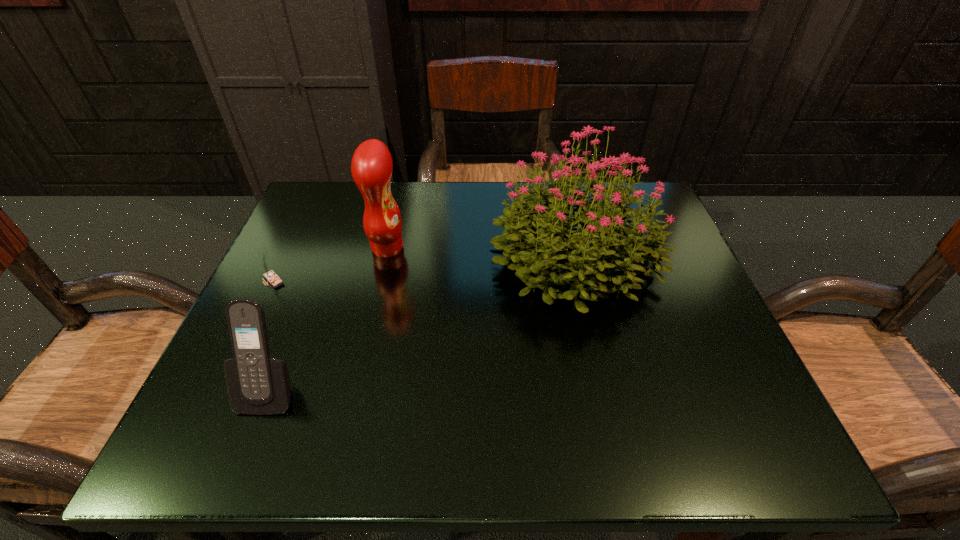
The height and width of the screenshot is (540, 960). In order to click on free location that satisfies the following two spatial constraints: 1. on the back side of the rightmost object; 2. on the label side of the second object from right to left in this screenshot , I will do 574,247.

Find the location of `free point that satisfies the following two spatial constraints: 1. on the back side of the rightmost object; 2. on the label side of the condiment`. free point that satisfies the following two spatial constraints: 1. on the back side of the rightmost object; 2. on the label side of the condiment is located at coordinates (574, 247).

Find the location of a particular element. The height and width of the screenshot is (540, 960). vacant region that satisfies the following two spatial constraints: 1. on the label side of the condiment; 2. on the front side of the shortest object is located at coordinates (379, 280).